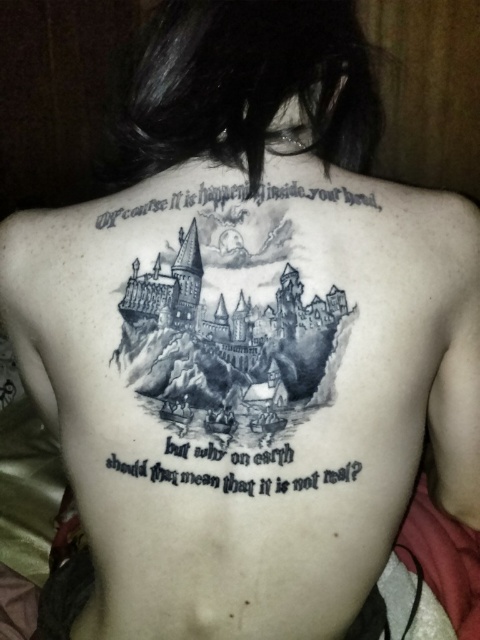
From the picture: You are a tattoo artist reviewing a client who has a castle tattoo on their back. The client wants to add a small star symbol near the black ink text at center. Given the coordinates provided, can you determine if the star will be placed above or below the text?

The coordinates for the black ink text at center are at point (233, 477). Since the y coordinate is 0.487, which is less than 0.5, the text is positioned slightly below the center of the image. Therefore, placing the star above the text would require coordinates with a higher y value than 0.487.